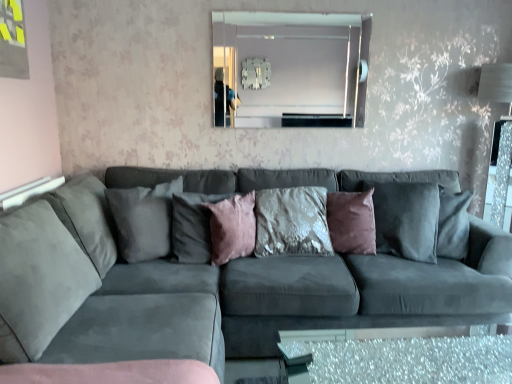
Question: Based on their sizes in the image, would you say clear glass mirror at upper center is bigger or smaller than suede gray couch at center?

Choices:
 (A) big
 (B) small

Answer: (B)

Question: Considering the positions of clear glass mirror at upper center and suede gray couch at center in the image, is clear glass mirror at upper center wider or thinner than suede gray couch at center?

Choices:
 (A) thin
 (B) wide

Answer: (A)

Question: Based on their relative distances, which object is nearer to the suede gray couch at center?

Choices:
 (A) pink velvet pillow at center, arranged as the 2th pillow when viewed from the left
 (B) clear glass mirror at upper center
 (C) clear glass table at lower center
 (D) pink velvet cushion at center, the 3th pillow viewed from the left
 (E) suede gray pillow at center, positioned as the fourth pillow in right-to-left order

Answer: (E)

Question: Which is farther from the clear glass table at lower center?

Choices:
 (A) pink velvet pillow at center, the 3th pillow viewed from the right
 (B) clear glass mirror at upper center
 (C) suede gray pillow at center, positioned as the fourth pillow in right-to-left order
 (D) suede gray couch at center
 (E) velvet textured pillow at center, placed as the first pillow when sorted from right to left

Answer: (B)